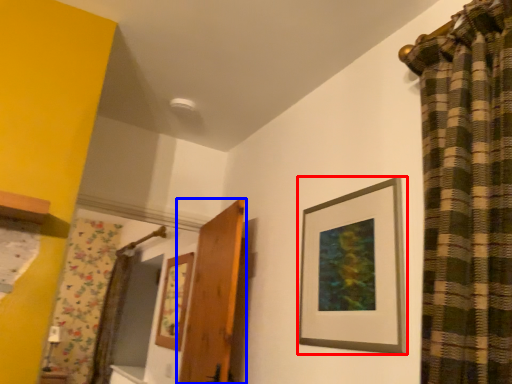
Question: Among these objects, which one is nearest to the camera, picture frame (highlighted by a red box) or door (highlighted by a blue box)?

Choices:
 (A) picture frame
 (B) door

Answer: (A)